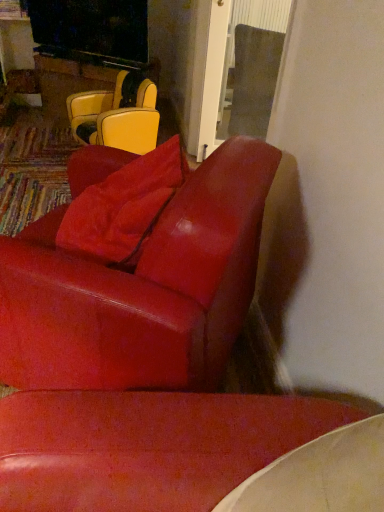
Question: Considering the positions of suede-like red pillow at upper center and glossy leather chair at center, the first chair positioned from the front, in the image, is suede-like red pillow at upper center wider or thinner than glossy leather chair at center, the first chair positioned from the front,?

Choices:
 (A) thin
 (B) wide

Answer: (A)

Question: Which is correct: suede-like red pillow at upper center is inside glossy leather chair at center, which is counted as the 1th chair, starting from the bottom, or outside of it?

Choices:
 (A) inside
 (B) outside

Answer: (A)

Question: Which of these objects is positioned farthest from the suede-like red pillow at upper center?

Choices:
 (A) glossy leather chair at center, the second chair in the top-to-bottom sequence
 (B) matte yellow leather chair at upper left, the second chair from the bottom

Answer: (B)

Question: Estimate the real-world distances between objects in this image. Which object is farther from the glossy leather chair at center, which is counted as the 1th chair, starting from the bottom?

Choices:
 (A) matte yellow leather chair at upper left, the second chair from the bottom
 (B) suede-like red pillow at upper center

Answer: (A)